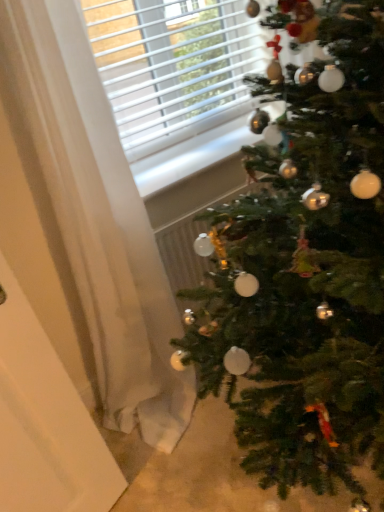
In order to click on white matte screen door at left in this screenshot , I will do `click(45, 423)`.

Locate an element on the screen. This screenshot has width=384, height=512. green matte christmas tree at right is located at coordinates (305, 266).

From the image's perspective, relative to white sheer curtain at left, is white matte screen door at left above or below?

Clearly, from the image's perspective, white matte screen door at left is below white sheer curtain at left.

Considering the relative positions of white matte screen door at left and white sheer curtain at left in the image provided, is white matte screen door at left to the left of white sheer curtain at left from the viewer's perspective?

Indeed, white matte screen door at left is positioned on the left side of white sheer curtain at left.

Is white matte screen door at left taller than white sheer curtain at left?

No, white matte screen door at left is not taller than white sheer curtain at left.

This screenshot has height=512, width=384. Identify the location of screen door below the white sheer curtain at left (from a real-world perspective). (45, 423).

Is white sheer curtain at left next to white matte screen door at left and touching it?

They are not placed beside each other.

Which is less distant, (x=144, y=389) or (x=5, y=323)?

Clearly, point (x=144, y=389) is more distant from the camera than point (x=5, y=323).

From a real-world perspective, is white sheer curtain at left beneath white matte screen door at left?

A: No, from a real-world perspective, white sheer curtain at left is not beneath white matte screen door at left.

Is white matte screen door at left a part of white sheer curtain at left?

That's incorrect, white matte screen door at left is not inside white sheer curtain at left.

From the picture: How many degrees apart are the facing directions of white matte screen door at left and green matte christmas tree at right?

white matte screen door at left and green matte christmas tree at right are facing 21.2 degrees away from each other.

Is point (8, 489) in front of point (194, 296)?

Yes, point (8, 489) is in front of point (194, 296).

In the image, there is a white matte screen door at left. At what (x,y) coordinates should I click in order to perform the action: click on christmas tree above it (from the image's perspective). Please return your answer as a coordinate pair (x, y). Looking at the image, I should click on (305, 266).

Is white matte screen door at left far away from green matte christmas tree at right?

No.

From a real-world perspective, is green matte christmas tree at right physically located above or below white sheer curtain at left?

Clearly, from a real-world perspective, green matte christmas tree at right is below white sheer curtain at left.

Is the surface of green matte christmas tree at right in direct contact with white sheer curtain at left?

No, green matte christmas tree at right is not next to white sheer curtain at left.

Does green matte christmas tree at right have a smaller size compared to white sheer curtain at left?

Actually, green matte christmas tree at right might be larger than white sheer curtain at left.

Is point (303, 6) more distant than point (22, 400)?

No.

Consider the image. Between green matte christmas tree at right and white matte screen door at left, which one has larger size?

green matte christmas tree at right is bigger.

Is green matte christmas tree at right positioned far away from white matte screen door at left?

No, green matte christmas tree at right is not far from white matte screen door at left.

Could white matte screen door at left be considered to be inside green matte christmas tree at right?

Actually, white matte screen door at left is outside green matte christmas tree at right.

Based on the photo, does white sheer curtain at left appear on the left side of green matte christmas tree at right?

Yes, white sheer curtain at left is to the left of green matte christmas tree at right.

Consider the image. Is white sheer curtain at left taller than green matte christmas tree at right?

Indeed, white sheer curtain at left has a greater height compared to green matte christmas tree at right.

Considering their positions, is white sheer curtain at left located in front of or behind green matte christmas tree at right?

white sheer curtain at left is behind green matte christmas tree at right.

Is white sheer curtain at left oriented towards green matte christmas tree at right?

Yes.

This screenshot has width=384, height=512. I want to click on screen door located in front of the white sheer curtain at left, so click(45, 423).

Where is `curtain above the white matte screen door at left (from a real-world perspective)`? curtain above the white matte screen door at left (from a real-world perspective) is located at coordinates (97, 218).

Which object lies nearer to the anchor point green matte christmas tree at right, white matte screen door at left or white sheer curtain at left?

white sheer curtain at left lies closer to green matte christmas tree at right than the other object.

Based on their spatial positions, is white sheer curtain at left or white matte screen door at left further from green matte christmas tree at right?

The object further to green matte christmas tree at right is white matte screen door at left.

Estimate the real-world distances between objects in this image. Which object is further from white matte screen door at left, white sheer curtain at left or green matte christmas tree at right?

Based on the image, green matte christmas tree at right appears to be further to white matte screen door at left.

Considering their positions, is green matte christmas tree at right positioned further to white matte screen door at left than white sheer curtain at left?

Among the two, green matte christmas tree at right is located further to white matte screen door at left.

Consider the image. Based on their spatial positions, is white matte screen door at left or green matte christmas tree at right closer to white sheer curtain at left?

Based on the image, white matte screen door at left appears to be nearer to white sheer curtain at left.

From the image, which object appears to be nearer to white sheer curtain at left, green matte christmas tree at right or white matte screen door at left?

white matte screen door at left lies closer to white sheer curtain at left than the other object.

Identify the location of curtain between white matte screen door at left and green matte christmas tree at right from left to right. (97, 218).